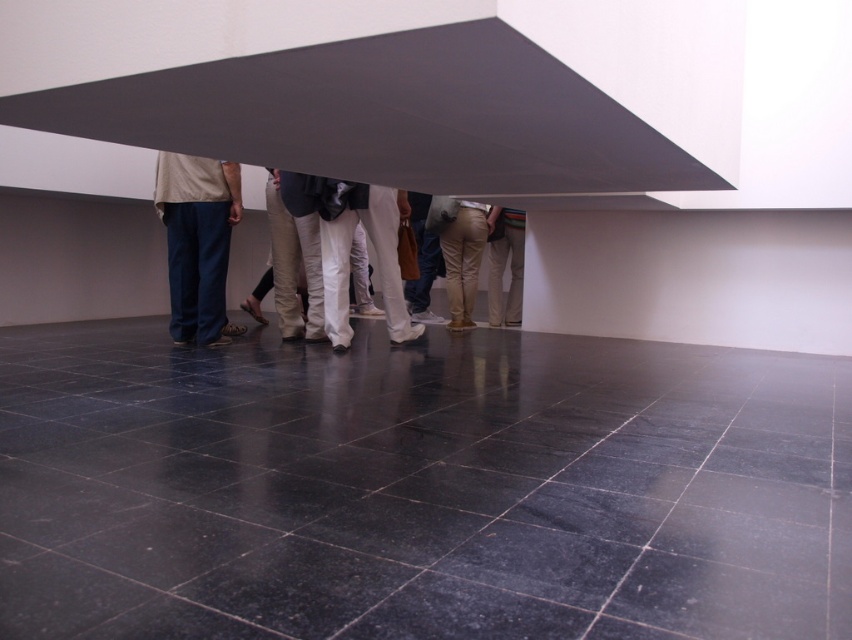
Question: Which point is farther to the camera?

Choices:
 (A) khaki cotton pants at center
 (B) denim pants at center
 (C) khaki pants at center

Answer: (A)

Question: Which object appears farthest from the camera in this image?

Choices:
 (A) khaki cotton pants at center
 (B) denim pants at center

Answer: (A)

Question: Which object is farther from the camera taking this photo?

Choices:
 (A) khaki cotton pants at center
 (B) denim pants at center

Answer: (A)

Question: Is khaki pants at center positioned at the back of khaki cotton pants at center?

Choices:
 (A) no
 (B) yes

Answer: (A)

Question: Can you confirm if khaki pants at center is positioned to the left of khaki cotton pants at center?

Choices:
 (A) yes
 (B) no

Answer: (A)

Question: From the image, what is the correct spatial relationship of denim pants at center in relation to khaki cotton pants at center?

Choices:
 (A) left
 (B) right

Answer: (A)